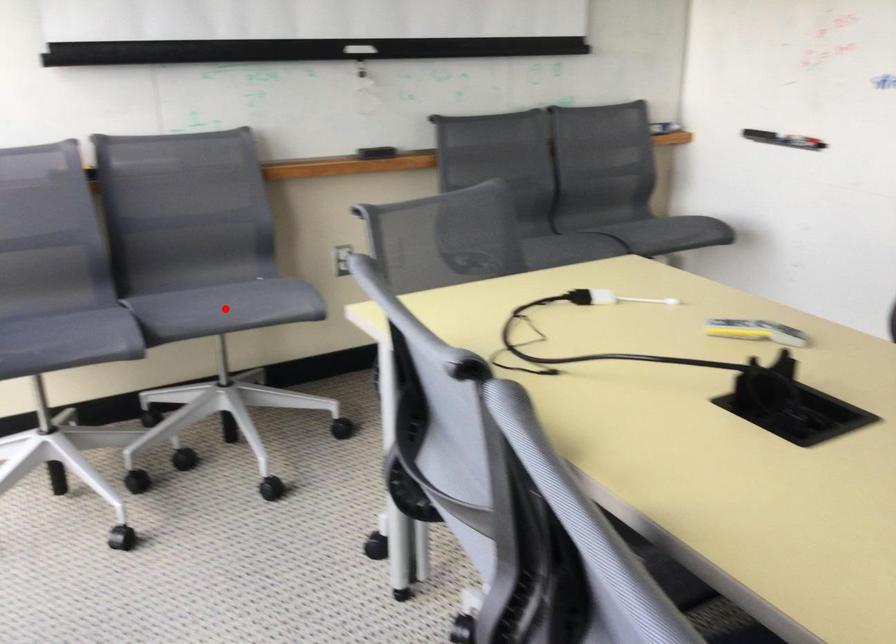
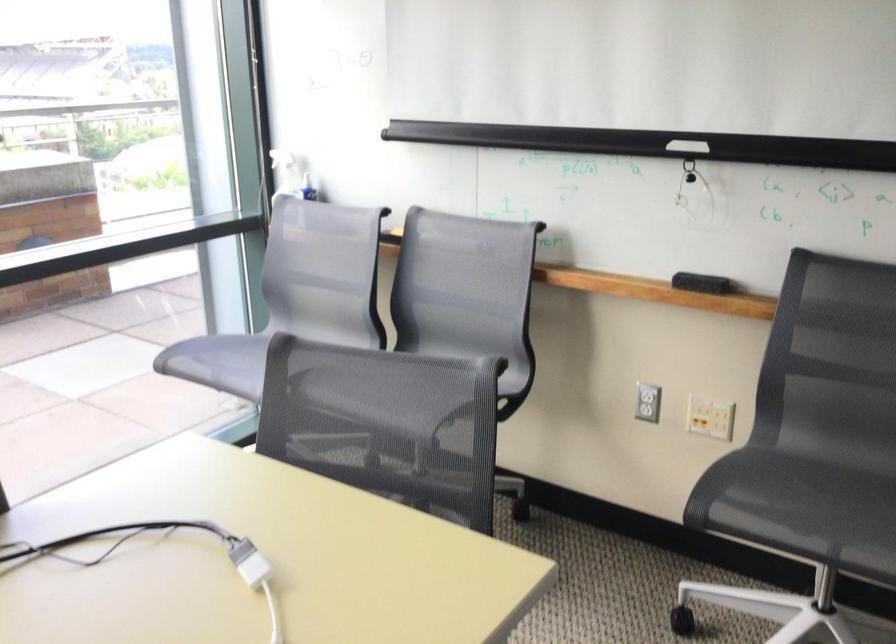
Question: I am providing you with two images of the same scene from different viewpoints. A red point is marked on the first image. At the location where the point appears in image 1, is it still visible in image 2?

Choices:
 (A) Yes
 (B) No

Answer: (B)